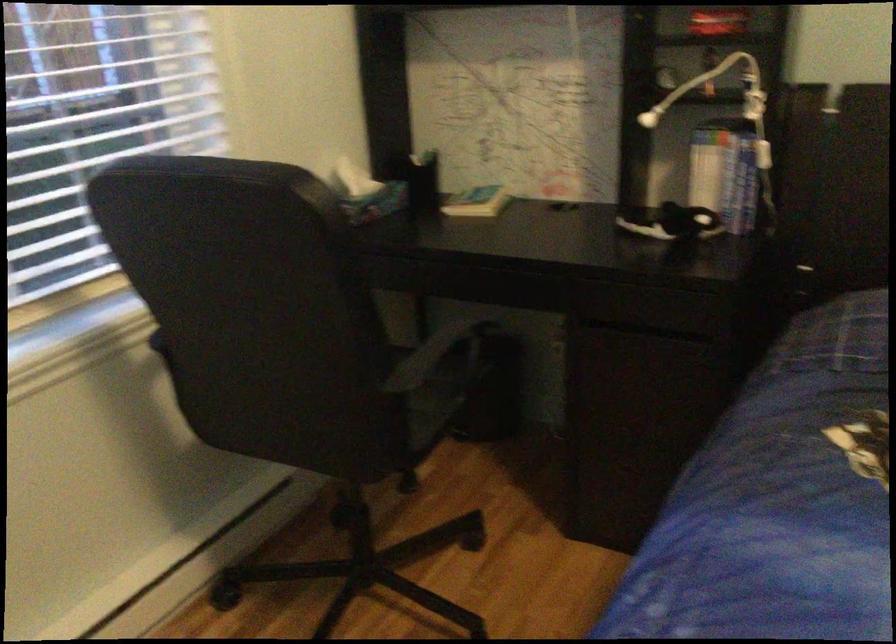
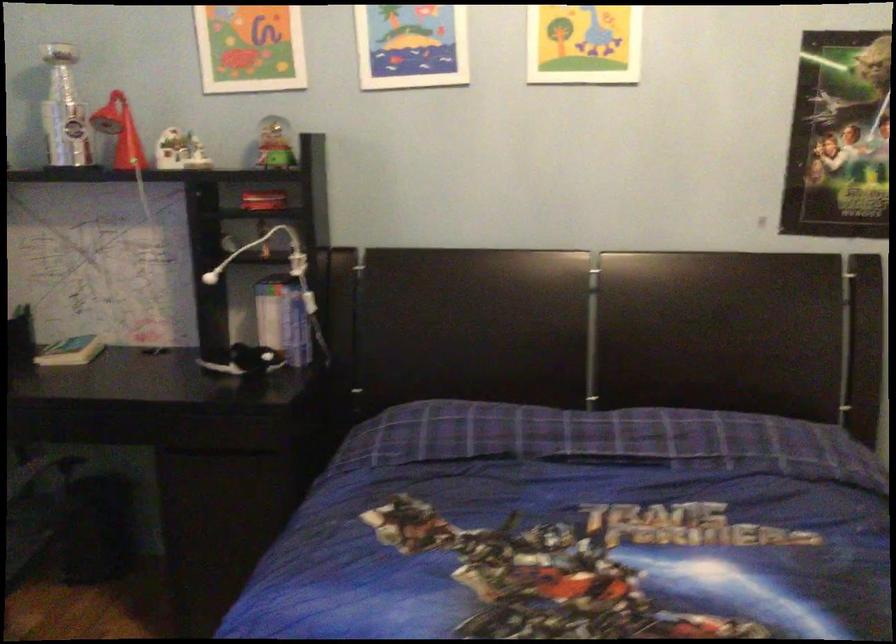
Find the pixel in the second image that matches (x=730, y=178) in the first image.

(288, 321)